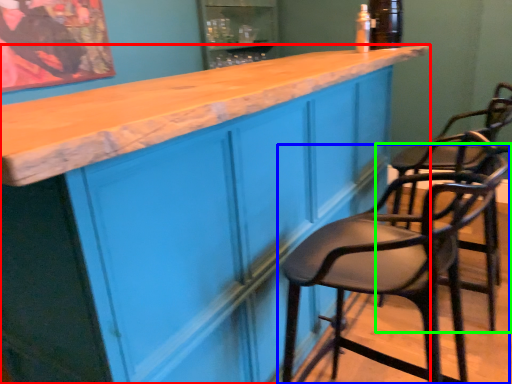
Question: Which object is positioned farthest from cabinetry (highlighted by a red box)? Select from chair (highlighted by a blue box) and chair (highlighted by a green box).

Choices:
 (A) chair
 (B) chair

Answer: (B)